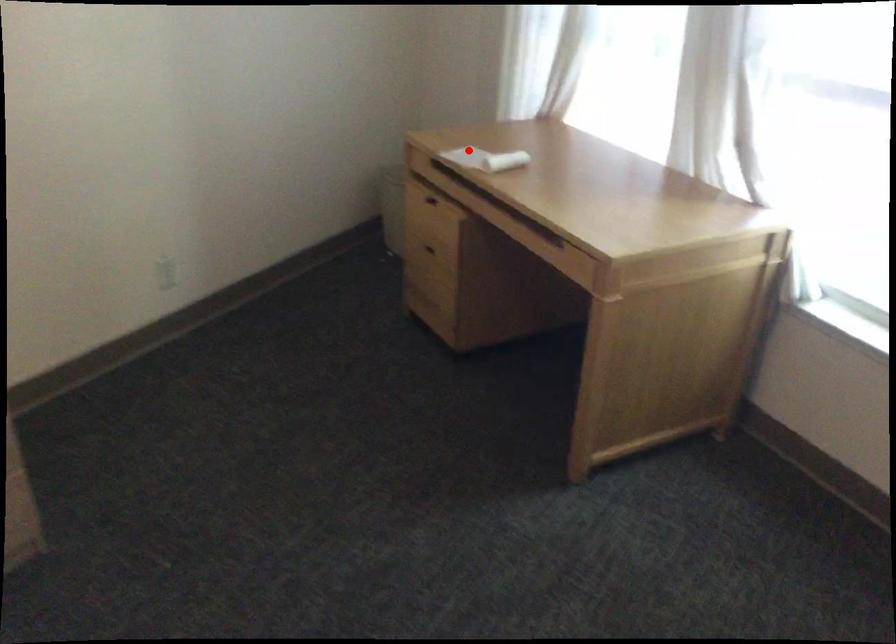
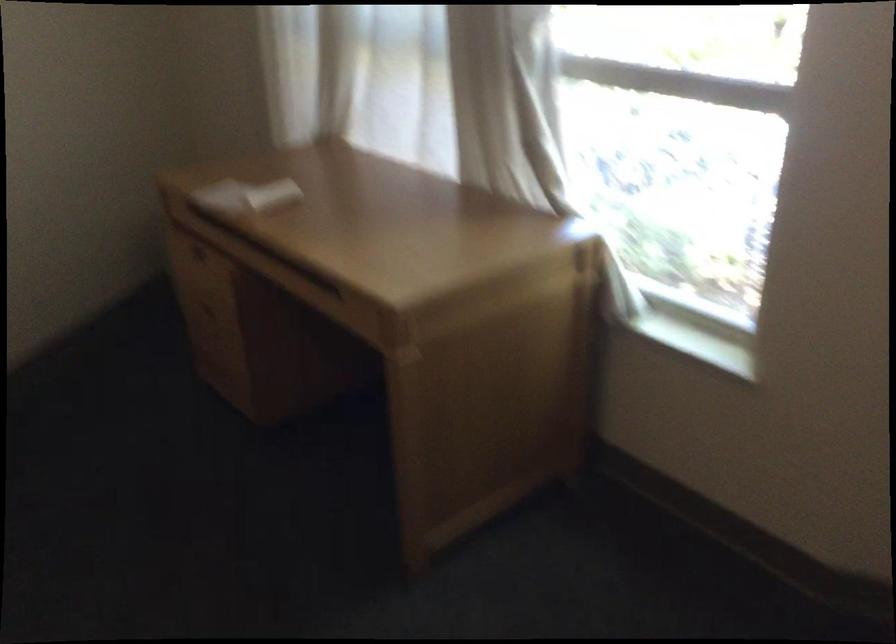
Find the pixel in the second image that matches the highlighted location in the first image.

(234, 191)